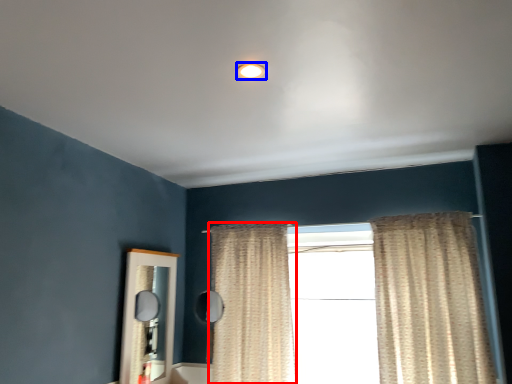
Question: Among these objects, which one is farthest to the camera, curtain (highlighted by a red box) or lighting (highlighted by a blue box)?

Choices:
 (A) curtain
 (B) lighting

Answer: (A)